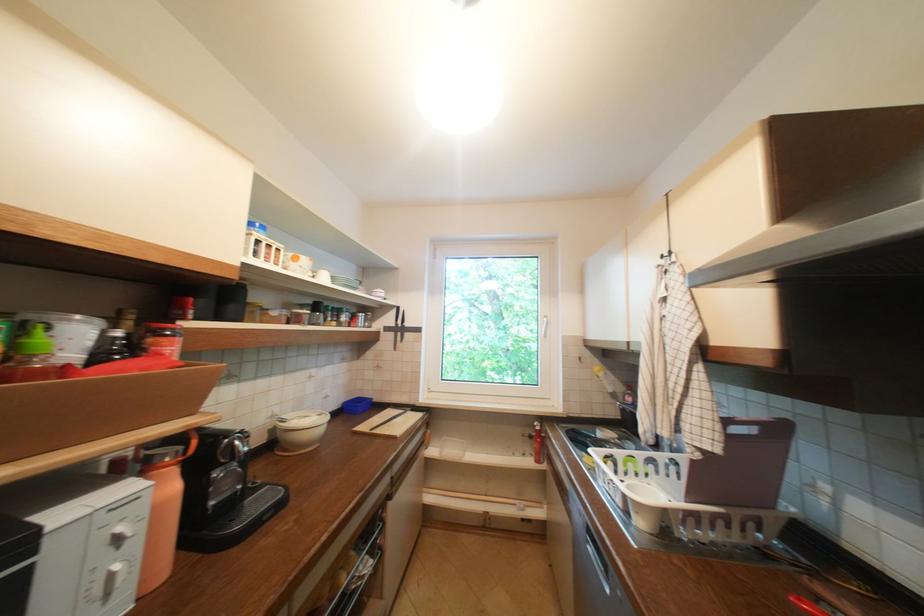
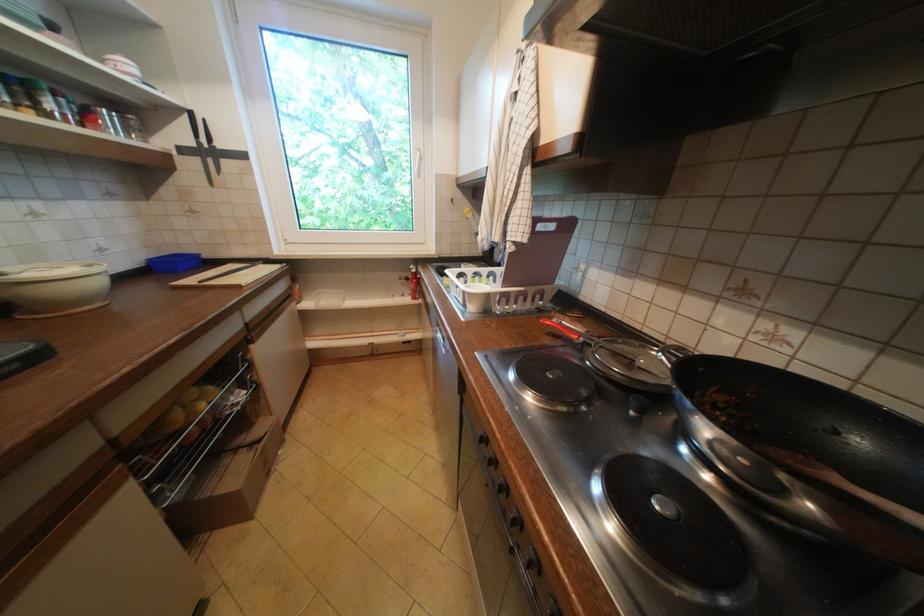
Where in the second image is the point corresponding to point (350, 408) from the first image?

(156, 267)